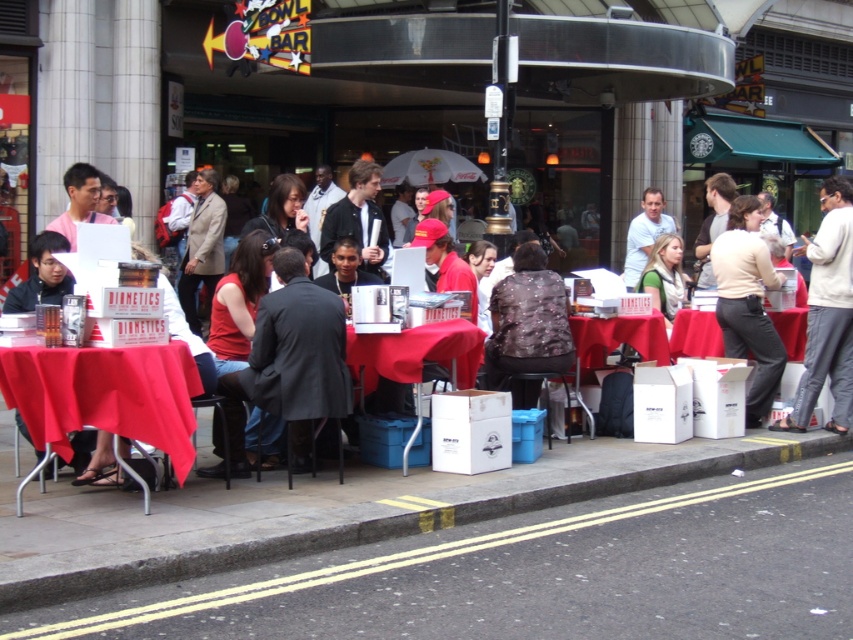
Does red cloth table at left have a greater width compared to red fabric table at center?

Indeed, red cloth table at left has a greater width compared to red fabric table at center.

The image size is (853, 640). What are the coordinates of `red cloth table at left` in the screenshot? It's located at (105, 394).

What do you see at coordinates (105, 394) in the screenshot?
I see `red cloth table at left` at bounding box center [105, 394].

Where is `red cloth table at left`? Image resolution: width=853 pixels, height=640 pixels. red cloth table at left is located at coordinates [x=105, y=394].

Does smooth asphalt road at lower center have a lesser width compared to white cardboard box at lower center?

In fact, smooth asphalt road at lower center might be wider than white cardboard box at lower center.

Which is behind, point (366, 586) or point (646, 348)?

The point (646, 348) is more distant.

In order to click on smooth asphalt road at lower center in this screenshot , I will do `click(537, 573)`.

Who is taller, red cloth table at left or red cloth table at center?

red cloth table at left

Does red cloth table at left appear over red cloth table at center?

No.

Does point (73, 355) come in front of point (469, 384)?

Yes, it is.

At what (x,y) coordinates should I click in order to perform the action: click on red cloth table at left. Please return your answer as a coordinate pair (x, y). The image size is (853, 640). Looking at the image, I should click on (105, 394).